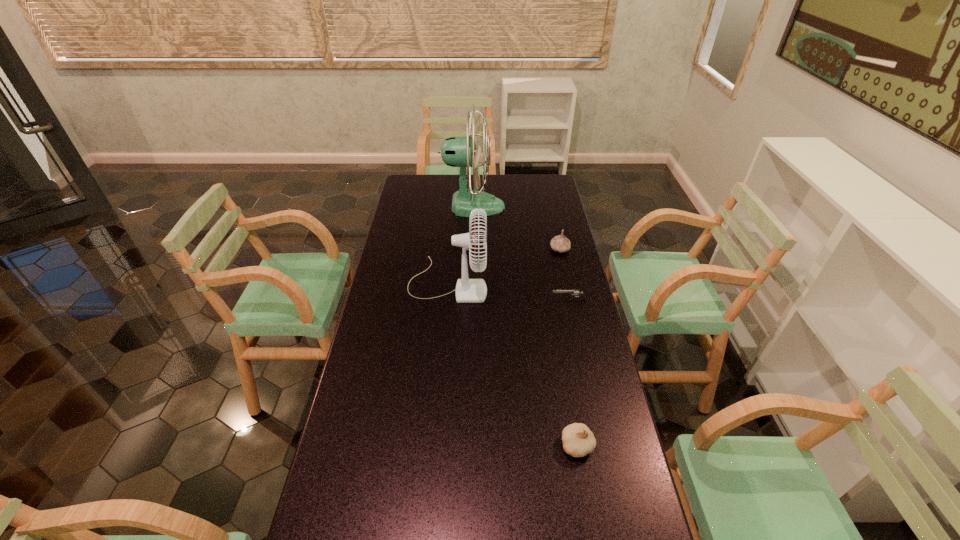
In order to click on vacant region at the right edge in this screenshot , I will do `click(620, 498)`.

Locate an element on the screen. This screenshot has height=540, width=960. free region at the far left corner of the desktop is located at coordinates (429, 177).

Locate an element on the screen. This screenshot has height=540, width=960. free space at the far right corner is located at coordinates (537, 179).

Find the location of a particular element. The image size is (960, 540). vacant area that lies between the nearer fan and the nearest object is located at coordinates (513, 364).

At what (x,y) coordinates should I click in order to perform the action: click on free space between the tallest object and the farther garlic. Please return your answer as a coordinate pair (x, y). The image size is (960, 540). Looking at the image, I should click on (516, 228).

Where is `vacant space in between the tallest object and the nearer garlic`? This screenshot has height=540, width=960. vacant space in between the tallest object and the nearer garlic is located at coordinates (525, 326).

Where is `free space between the fourth nearest object and the shorter garlic`? This screenshot has width=960, height=540. free space between the fourth nearest object and the shorter garlic is located at coordinates (568, 348).

Where is `free space between the fourth shortest object and the shortest object`? The width and height of the screenshot is (960, 540). free space between the fourth shortest object and the shortest object is located at coordinates (508, 292).

I want to click on vacant area that lies between the fourth nearest object and the shorter fan, so click(x=504, y=266).

Locate which object ranks in proximity to the nearer fan. Please provide its 2D coordinates. Your answer should be formatted as a tuple, i.e. [(x, y)], where the tuple contains the x and y coordinates of a point satisfying the conditions above.

[(455, 151)]